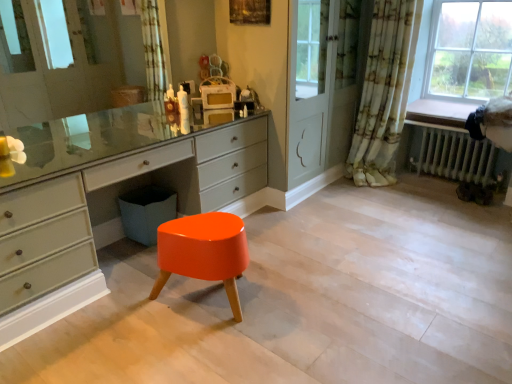
Question: From the image's perspective, is glossy orange stool at center under floral fabric curtain at right?

Choices:
 (A) no
 (B) yes

Answer: (B)

Question: Is glossy orange stool at center closer to camera compared to floral fabric curtain at right?

Choices:
 (A) yes
 (B) no

Answer: (A)

Question: Is glossy orange stool at center not close to floral fabric curtain at right?

Choices:
 (A) no
 (B) yes

Answer: (B)

Question: Is glossy orange stool at center turned away from floral fabric curtain at right?

Choices:
 (A) yes
 (B) no

Answer: (B)

Question: Considering the relative positions of glossy orange stool at center and floral fabric curtain at right in the image provided, is glossy orange stool at center to the right of floral fabric curtain at right from the viewer's perspective?

Choices:
 (A) no
 (B) yes

Answer: (A)

Question: Based on their positions, is floral fabric curtain at right located to the left or right of metallic radiator at lower right?

Choices:
 (A) right
 (B) left

Answer: (B)

Question: From the image's perspective, relative to metallic radiator at lower right, is floral fabric curtain at right above or below?

Choices:
 (A) above
 (B) below

Answer: (A)

Question: Is floral fabric curtain at right spatially inside metallic radiator at lower right, or outside of it?

Choices:
 (A) inside
 (B) outside

Answer: (B)

Question: From a real-world perspective, is floral fabric curtain at right above or below metallic radiator at lower right?

Choices:
 (A) below
 (B) above

Answer: (B)

Question: Visually, is glossy orange stool at center positioned to the left or to the right of metallic radiator at lower right?

Choices:
 (A) left
 (B) right

Answer: (A)

Question: Considering the positions of glossy orange stool at center and metallic radiator at lower right in the image, is glossy orange stool at center taller or shorter than metallic radiator at lower right?

Choices:
 (A) short
 (B) tall

Answer: (A)

Question: From a real-world perspective, is glossy orange stool at center physically located above or below metallic radiator at lower right?

Choices:
 (A) below
 (B) above

Answer: (A)

Question: Is point (238, 309) closer or farther from the camera than point (479, 157)?

Choices:
 (A) farther
 (B) closer

Answer: (B)

Question: Which is correct: glossy orange stool at center is inside floral fabric curtain at right, or outside of it?

Choices:
 (A) outside
 (B) inside

Answer: (A)

Question: From the image's perspective, is glossy orange stool at center positioned above or below floral fabric curtain at right?

Choices:
 (A) below
 (B) above

Answer: (A)